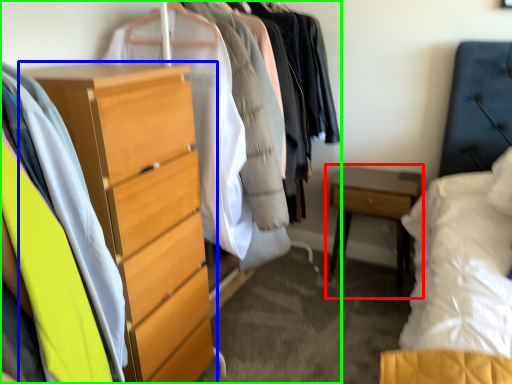
Question: Based on their relative distances, which object is farther from nightstand (highlighted by a red box)? Choose from chest of drawers (highlighted by a blue box) and closet (highlighted by a green box).

Choices:
 (A) chest of drawers
 (B) closet

Answer: (B)